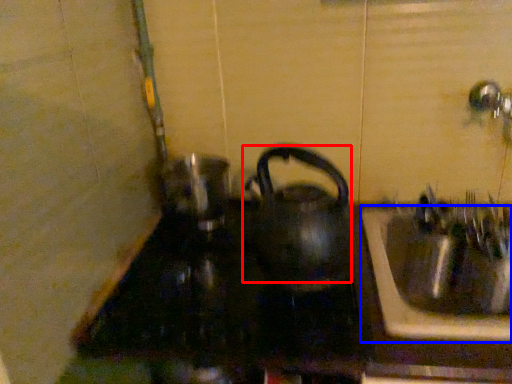
Question: Among these objects, which one is farthest to the camera, kettle (highlighted by a red box) or sink (highlighted by a blue box)?

Choices:
 (A) kettle
 (B) sink

Answer: (B)